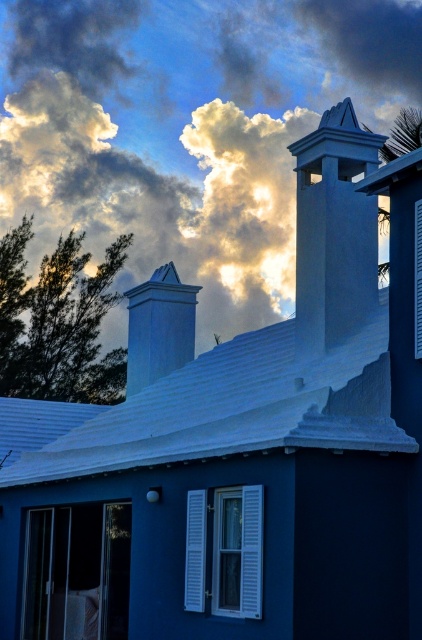
Question: Which object appears farthest from the camera in this image?

Choices:
 (A) smooth white chimney at upper right
 (B) white smooth chimney at upper center

Answer: (B)

Question: Among these objects, which one is nearest to the camera?

Choices:
 (A) smooth white chimney at upper right
 (B) cloudy sky at upper center
 (C) white smooth chimney at upper center

Answer: (B)

Question: Which object appears farthest from the camera in this image?

Choices:
 (A) white smooth chimney at upper center
 (B) cloudy sky at upper center
 (C) smooth white chimney at upper right

Answer: (A)

Question: Does smooth white chimney at upper right appear on the left side of white smooth chimney at upper center?

Choices:
 (A) no
 (B) yes

Answer: (A)

Question: Does smooth white chimney at upper right appear on the left side of white smooth chimney at upper center?

Choices:
 (A) no
 (B) yes

Answer: (A)

Question: Does cloudy sky at upper center appear on the left side of white smooth chimney at upper center?

Choices:
 (A) yes
 (B) no

Answer: (B)